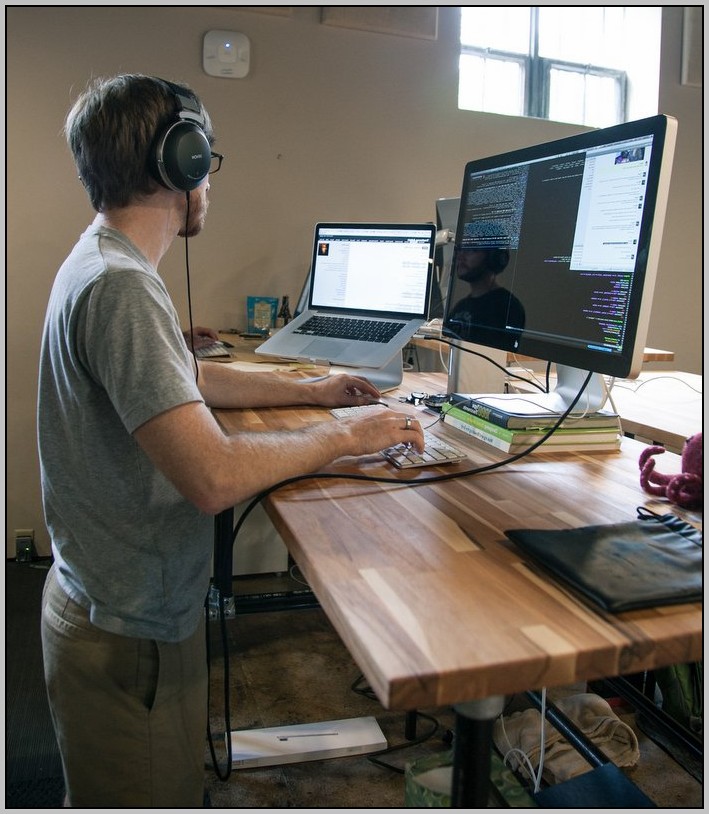
The height and width of the screenshot is (814, 709). In order to click on macbook laptop in this screenshot , I will do `click(362, 281)`.